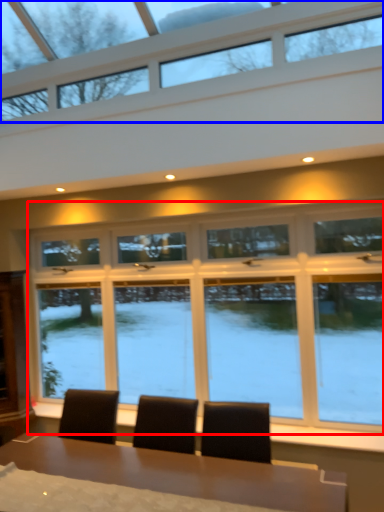
Question: Which object appears closest to the camera in this image, window (highlighted by a red box) or window (highlighted by a blue box)?

Choices:
 (A) window
 (B) window

Answer: (B)